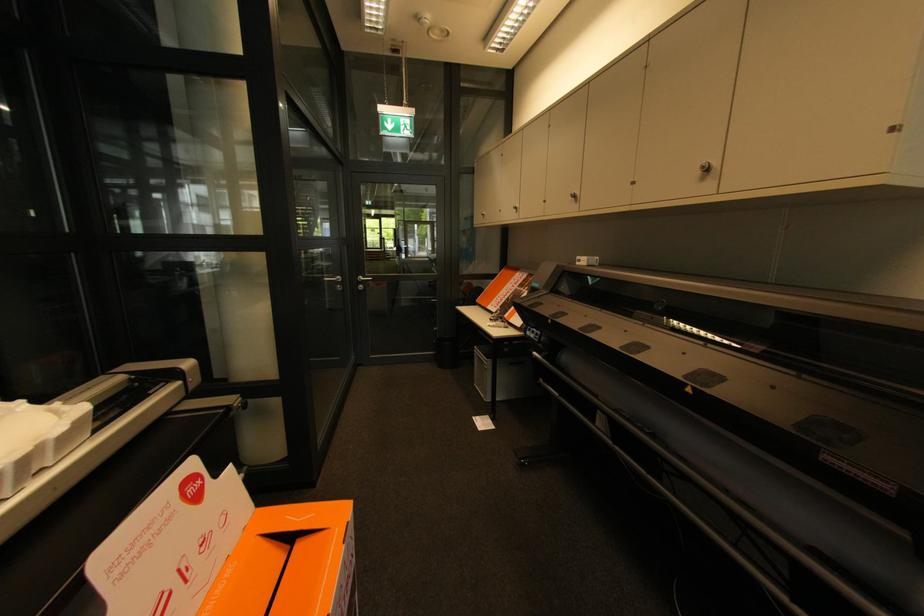
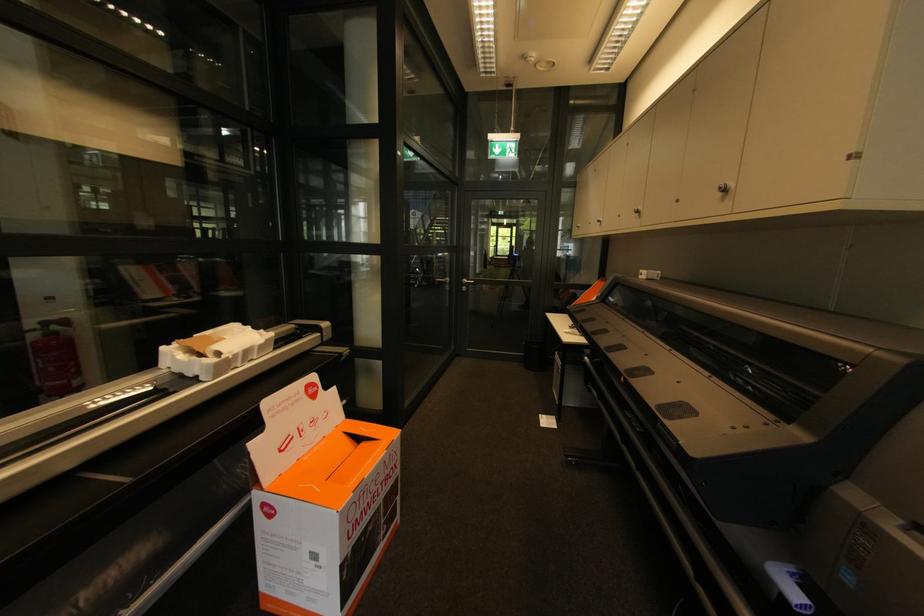
The point at (711, 169) is marked in the first image. Where is the corresponding point in the second image?

(727, 191)